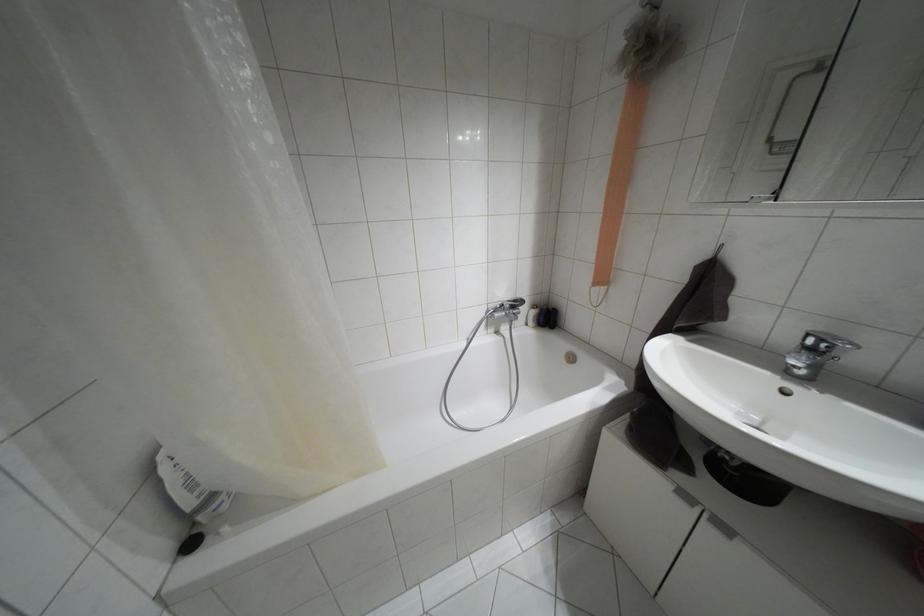
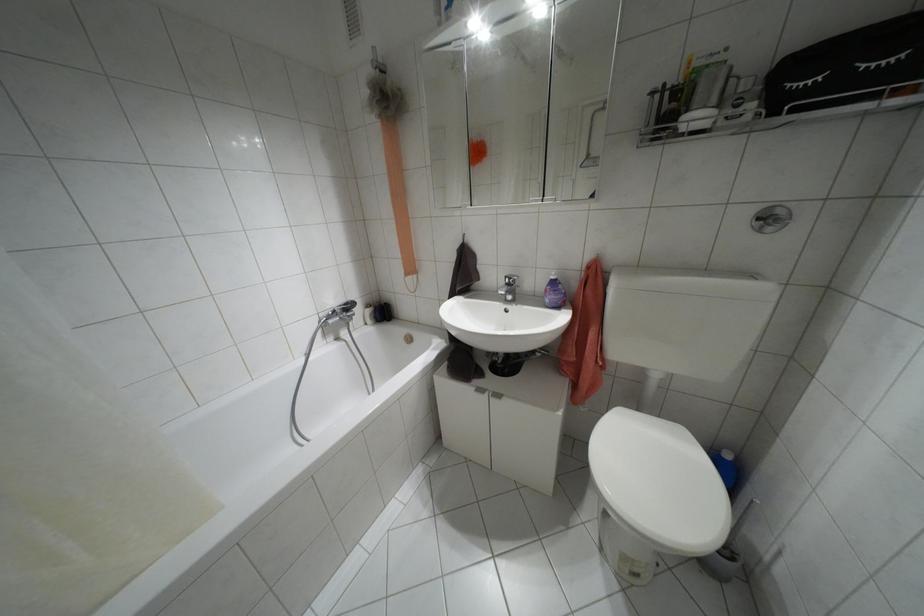
Where in the second image is the point corresponding to (811,350) from the first image?

(507, 284)